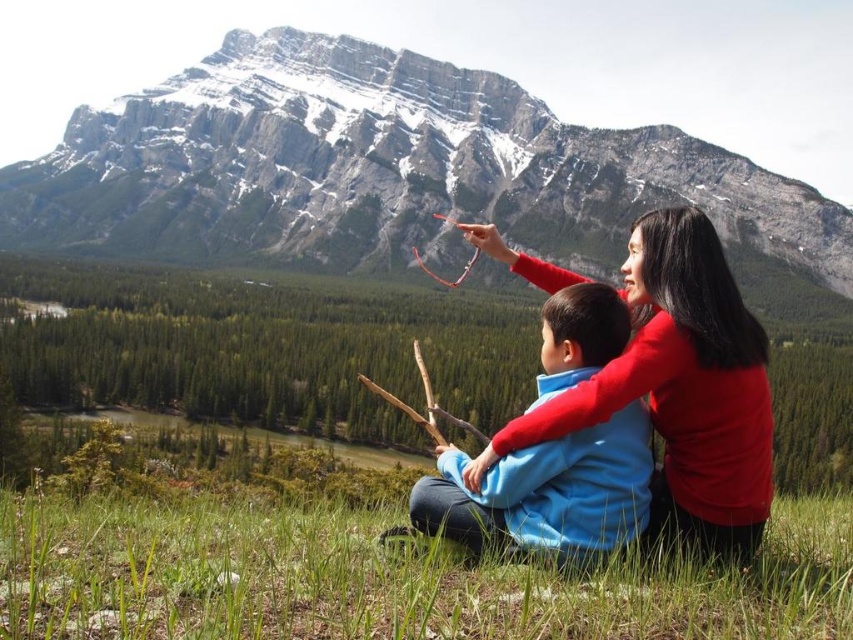
Measure the distance from snowy granite mountain at upper center to blue fleece jacket at center.

The distance of snowy granite mountain at upper center from blue fleece jacket at center is 230.32 meters.

Who is more distant from viewer, [636,200] or [585,376]?

Positioned behind is point [636,200].

In order to click on snowy granite mountain at upper center in this screenshot , I will do `click(383, 168)`.

Who is higher up, snowy granite mountain at upper center or red matte sweater at center?

snowy granite mountain at upper center

Does point (135, 138) lie in front of point (547, 412)?

That is False.

The height and width of the screenshot is (640, 853). Identify the location of snowy granite mountain at upper center. (383, 168).

Who is higher up, red matte sweater at center or blue fleece jacket at center?

red matte sweater at center is above.

Who is positioned more to the left, red matte sweater at center or blue fleece jacket at center?

blue fleece jacket at center

What do you see at coordinates (679, 388) in the screenshot? This screenshot has width=853, height=640. I see `red matte sweater at center` at bounding box center [679, 388].

The width and height of the screenshot is (853, 640). I want to click on red matte sweater at center, so click(679, 388).